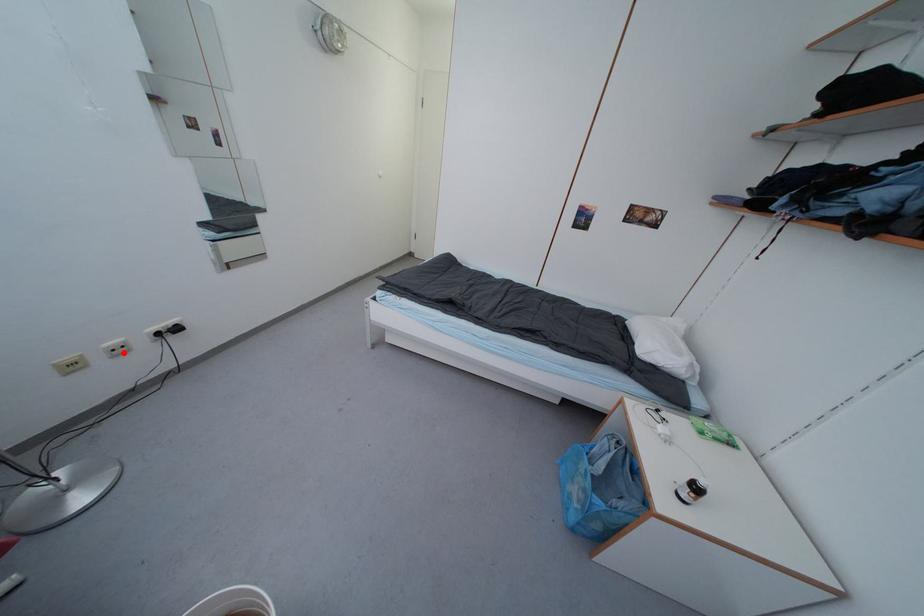
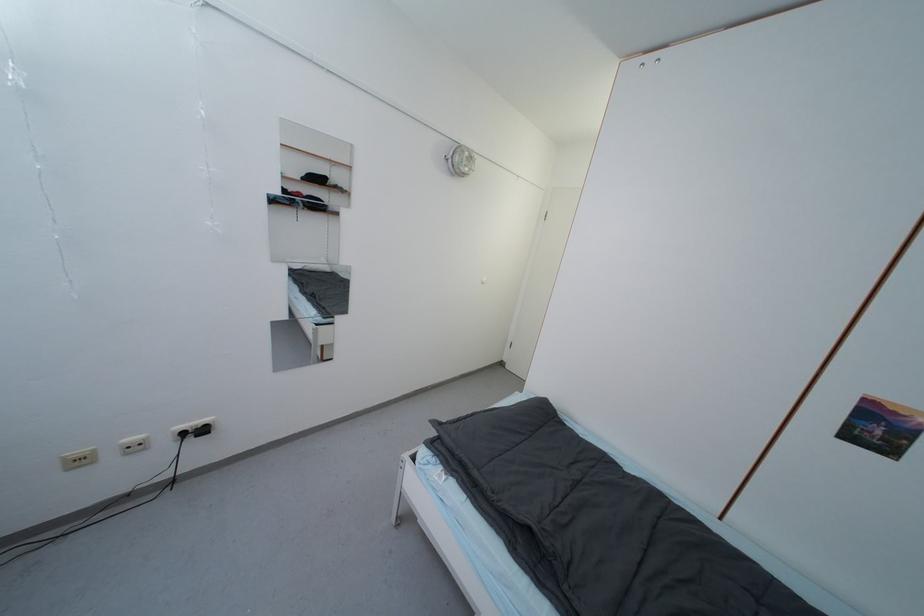
Where in the second image is the point corresponding to the highlighted location from the first image?

(140, 450)